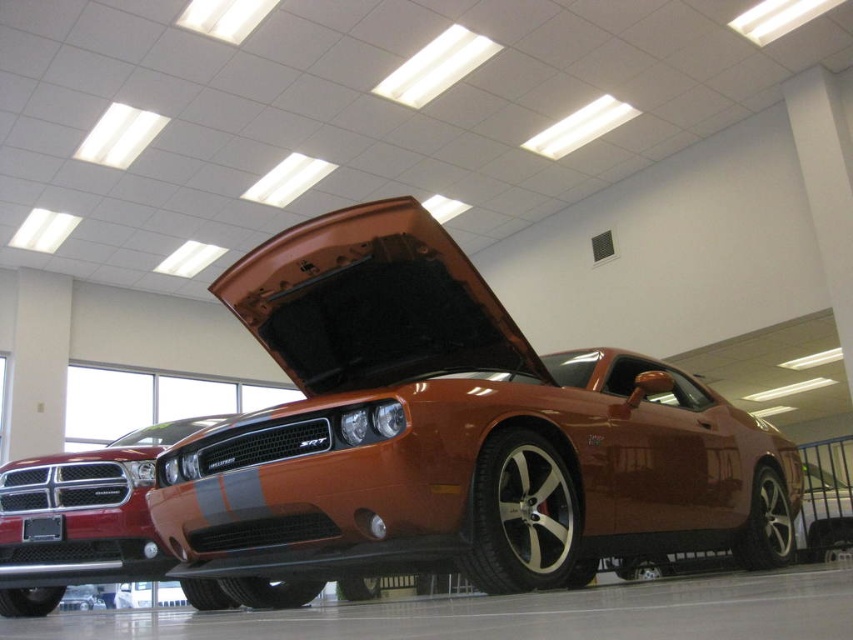
Question: Considering the real-world distances, which object is closest to the shiny orange muscle car at center?

Choices:
 (A) orange matte hood at center
 (B) glossy metallic car at center

Answer: (A)

Question: Can you confirm if orange matte hood at center is positioned below glossy metallic car at center?

Choices:
 (A) yes
 (B) no

Answer: (B)

Question: Which object appears farthest from the camera in this image?

Choices:
 (A) shiny orange muscle car at center
 (B) glossy metallic car at center
 (C) orange matte hood at center

Answer: (B)

Question: Among these points, which one is farthest from the camera?

Choices:
 (A) (44, 616)
 (B) (599, 477)

Answer: (A)

Question: Can you confirm if shiny orange muscle car at center is positioned below glossy metallic car at center?

Choices:
 (A) no
 (B) yes

Answer: (A)

Question: Is shiny orange muscle car at center above orange matte hood at center?

Choices:
 (A) no
 (B) yes

Answer: (A)